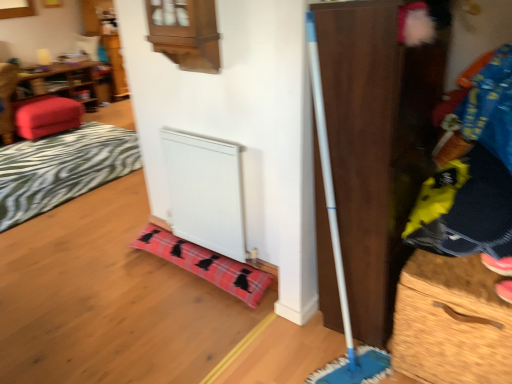
Find the location of a particular element. This screenshot has height=384, width=512. wooden drawer at right is located at coordinates (449, 336).

Find the location of a particular element. This screenshot has height=384, width=512. wooden dresser at right is located at coordinates (377, 142).

Locate an element on the screen. The width and height of the screenshot is (512, 384). blue denim jeans at right is located at coordinates (473, 175).

This screenshot has height=384, width=512. I want to click on plaid fabric blanket at lower center, which ranks as the 1th blanket in bottom-to-top order, so click(206, 264).

In order to click on white matte radiator at lower center in this screenshot , I will do `click(205, 191)`.

From the image's perspective, is blue denim jeans at right positioned above or below plaid fabric blanket at lower left, acting as the 2th blanket starting from the front?

Based on their image positions, blue denim jeans at right is located beneath plaid fabric blanket at lower left, acting as the 2th blanket starting from the front.

In the scene shown: Between blue denim jeans at right and plaid fabric blanket at lower left, which ranks as the second blanket in bottom-to-top order, which one is positioned in front?

blue denim jeans at right.

Which point is more distant from viewer, (418, 204) or (7, 212)?

Point (7, 212)

Considering the sizes of objects blue denim jeans at right and plaid fabric blanket at lower left, which ranks as the second blanket in bottom-to-top order, in the image provided, who is taller, blue denim jeans at right or plaid fabric blanket at lower left, which ranks as the second blanket in bottom-to-top order,?

Standing taller between the two is blue denim jeans at right.

Is plaid fabric blanket at lower center, which is counted as the second blanket, starting from the back, directly adjacent to wooden drawer at right?

No, plaid fabric blanket at lower center, which is counted as the second blanket, starting from the back, is not beside wooden drawer at right.

Could you tell me if plaid fabric blanket at lower center, positioned as the 1th blanket in right-to-left order, is facing wooden drawer at right?

No, plaid fabric blanket at lower center, positioned as the 1th blanket in right-to-left order, is not turned towards wooden drawer at right.

From a real-world perspective, is plaid fabric blanket at lower center, arranged as the 1th blanket when viewed from the front, beneath wooden drawer at right?

Correct, in the physical world, plaid fabric blanket at lower center, arranged as the 1th blanket when viewed from the front, is lower than wooden drawer at right.

Considering the relative sizes of plaid fabric blanket at lower center, placed as the second blanket when sorted from top to bottom, and wooden drawer at right in the image provided, is plaid fabric blanket at lower center, placed as the second blanket when sorted from top to bottom, shorter than wooden drawer at right?

Yes.

Is point (97, 87) farther from camera compared to point (63, 179)?

Yes, it is.

Is velvet red ottoman at left positioned beyond the bounds of plaid fabric blanket at lower left, which is the 1th blanket in back-to-front order?

That's correct, velvet red ottoman at left is outside of plaid fabric blanket at lower left, which is the 1th blanket in back-to-front order.

Considering the relative positions of velvet red ottoman at left and plaid fabric blanket at lower left, which ranks as the 1th blanket in left-to-right order, in the image provided, is velvet red ottoman at left to the left or to the right of plaid fabric blanket at lower left, which ranks as the 1th blanket in left-to-right order,?

Based on their positions, velvet red ottoman at left is located to the left of plaid fabric blanket at lower left, which ranks as the 1th blanket in left-to-right order.

Is the position of velvet red ottoman at left more distant than that of plaid fabric blanket at lower left, which ranks as the second blanket in bottom-to-top order?

Yes, velvet red ottoman at left is further from the camera.

Considering their positions, is wooden dresser at right located in front of or behind plaid fabric blanket at lower center, which is the second blanket from left to right?

In the image, wooden dresser at right appears in front of plaid fabric blanket at lower center, which is the second blanket from left to right.

Is wooden dresser at right completely or partially outside of plaid fabric blanket at lower center, positioned as the 1th blanket in right-to-left order?

wooden dresser at right is positioned outside plaid fabric blanket at lower center, positioned as the 1th blanket in right-to-left order.

From a real-world perspective, does wooden dresser at right sit lower than plaid fabric blanket at lower center, arranged as the 1th blanket when viewed from the front?

Incorrect, from a real-world perspective, wooden dresser at right is higher than plaid fabric blanket at lower center, arranged as the 1th blanket when viewed from the front.

Is wooden dresser at right positioned far away from plaid fabric blanket at lower center, which is the second blanket from left to right?

wooden dresser at right is near plaid fabric blanket at lower center, which is the second blanket from left to right, not far away.

Considering the relative positions of blue denim jeans at right and pink suede shoe at lower right in the image provided, is blue denim jeans at right to the left of pink suede shoe at lower right from the viewer's perspective?

Yes.

From their relative heights in the image, would you say blue denim jeans at right is taller or shorter than pink suede shoe at lower right?

Clearly, blue denim jeans at right is taller compared to pink suede shoe at lower right.

How much distance is there between blue denim jeans at right and pink suede shoe at lower right?

blue denim jeans at right and pink suede shoe at lower right are 11.10 inches apart from each other.

Where is `clothing located in front of the pink suede shoe at lower right`? clothing located in front of the pink suede shoe at lower right is located at coordinates (473, 175).

From a real-world perspective, is matte red ottoman at left on top of plaid fabric blanket at lower center, positioned as the 1th blanket in right-to-left order?

Correct, in the physical world, matte red ottoman at left is higher than plaid fabric blanket at lower center, positioned as the 1th blanket in right-to-left order.

From the image's perspective, is matte red ottoman at left on top of plaid fabric blanket at lower center, which ranks as the 1th blanket in bottom-to-top order?

Correct, matte red ottoman at left appears higher than plaid fabric blanket at lower center, which ranks as the 1th blanket in bottom-to-top order, in the image.

From a real-world perspective, is matte red ottoman at left over pink suede shoe at lower right?

No, from a real-world perspective, matte red ottoman at left is not on top of pink suede shoe at lower right.

Can you tell me how much matte red ottoman at left and pink suede shoe at lower right differ in facing direction?

The angular difference between matte red ottoman at left and pink suede shoe at lower right is 138 degrees.

From the image's perspective, is matte red ottoman at left on top of pink suede shoe at lower right?

Correct, matte red ottoman at left appears higher than pink suede shoe at lower right in the image.

Does matte red ottoman at left have a lesser width compared to pink suede shoe at lower right?

Incorrect, the width of matte red ottoman at left is not less than that of pink suede shoe at lower right.

Where is `clothing lying in front of the plaid fabric blanket at lower left, positioned as the first blanket in top-to-bottom order`? The height and width of the screenshot is (384, 512). clothing lying in front of the plaid fabric blanket at lower left, positioned as the first blanket in top-to-bottom order is located at coordinates (473, 175).

This screenshot has height=384, width=512. I want to click on drawer that is below the plaid fabric blanket at lower center, placed as the second blanket when sorted from top to bottom (from the image's perspective), so pyautogui.click(x=449, y=336).

When comparing their distances from matte red ottoman at left, does wooden dresser at right or wooden drawer at right seem further?

wooden drawer at right lies further to matte red ottoman at left than the other object.

Looking at the image, which one is located further to wooden drawer at right, velvet red ottoman at left or plaid fabric blanket at lower center, arranged as the 1th blanket when viewed from the front?

velvet red ottoman at left is further to wooden drawer at right.

Estimate the real-world distances between objects in this image. Which object is closer to wooden drawer at right, blue denim jeans at right or velvet red ottoman at left?

blue denim jeans at right lies closer to wooden drawer at right than the other object.

From the image, which object appears to be farther from velvet red ottoman at left, matte red ottoman at left or plaid fabric blanket at lower center, which ranks as the 1th blanket in bottom-to-top order?

The object further to velvet red ottoman at left is plaid fabric blanket at lower center, which ranks as the 1th blanket in bottom-to-top order.

Which object lies further to the anchor point plaid fabric blanket at lower left, positioned as the first blanket in top-to-bottom order, wooden dresser at right or blue denim jeans at right?

blue denim jeans at right is further to plaid fabric blanket at lower left, positioned as the first blanket in top-to-bottom order.

When comparing their distances from blue denim jeans at right, does wooden drawer at right or pink suede shoe at lower right seem further?

Among the two, wooden drawer at right is located further to blue denim jeans at right.

When comparing their distances from blue denim jeans at right, does wooden drawer at right or plaid fabric blanket at lower left, which is the 1th blanket in back-to-front order, seem further?

plaid fabric blanket at lower left, which is the 1th blanket in back-to-front order, is positioned further to the anchor blue denim jeans at right.

Based on their spatial positions, is velvet red ottoman at left or plaid fabric blanket at lower center, arranged as the 1th blanket when viewed from the front, closer to plaid fabric blanket at lower left, which is the 1th blanket in back-to-front order?

Based on the image, velvet red ottoman at left appears to be nearer to plaid fabric blanket at lower left, which is the 1th blanket in back-to-front order.

Find the location of `drawer situated between matte red ottoman at left and pink suede shoe at lower right from left to right`. drawer situated between matte red ottoman at left and pink suede shoe at lower right from left to right is located at coordinates (449, 336).

You are a GUI agent. You are given a task and a screenshot of the screen. Output one action in this format:
    pyautogui.click(x=<x>, y=<y>)
    Task: Click on the drawer between plaid fabric blanket at lower left, which ranks as the second blanket in bottom-to-top order, and blue denim jeans at right, in the horizontal direction
    The width and height of the screenshot is (512, 384).
    Given the screenshot: What is the action you would take?
    pyautogui.click(x=449, y=336)

The width and height of the screenshot is (512, 384). What are the coordinates of `furniture between velvet red ottoman at left and pink suede shoe at lower right in the horizontal direction` in the screenshot? It's located at (46, 116).

You are a GUI agent. You are given a task and a screenshot of the screen. Output one action in this format:
    pyautogui.click(x=<x>, y=<y>)
    Task: Click on the furniture between white matte radiator at lower center and velvet red ottoman at left in the front-back direction
    This screenshot has width=512, height=384.
    Given the screenshot: What is the action you would take?
    pyautogui.click(x=46, y=116)